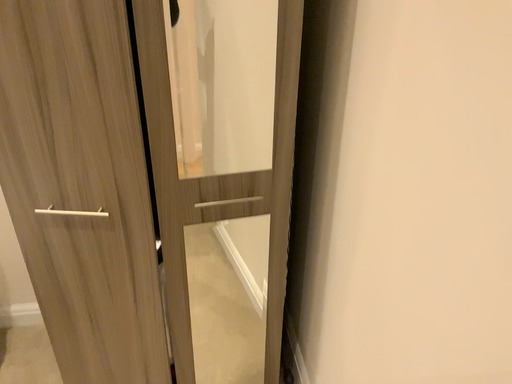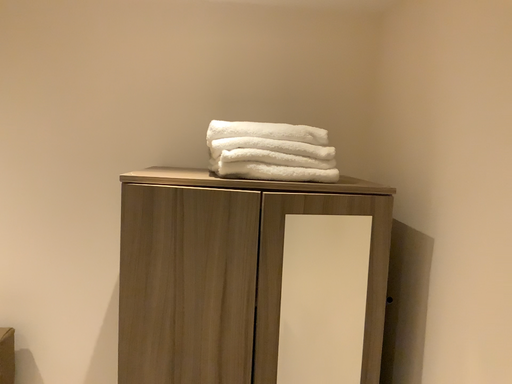
Question: How did the camera likely rotate when shooting the video?

Choices:
 (A) rotated upward
 (B) rotated downward

Answer: (A)